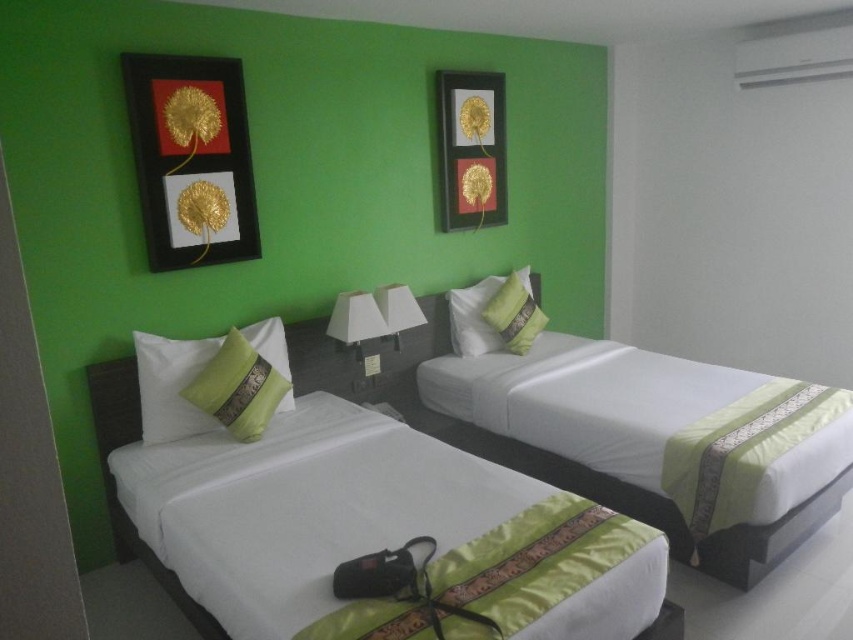
Question: Is black matte picture frame at upper left bigger than green satin pillow at center?

Choices:
 (A) no
 (B) yes

Answer: (B)

Question: Which object appears closest to the camera in this image?

Choices:
 (A) satin white bed at center
 (B) green satin pillow at left
 (C) green satin pillow at center

Answer: (A)

Question: Which point appears farthest from the camera in this image?

Choices:
 (A) pyautogui.click(x=498, y=294)
 (B) pyautogui.click(x=532, y=465)
 (C) pyautogui.click(x=497, y=80)
 (D) pyautogui.click(x=241, y=161)

Answer: (C)

Question: Which object is positioned closest to the gold leaf picture frame at upper center?

Choices:
 (A) satin white bed at center
 (B) green satin pillow at left
 (C) black matte picture frame at upper left

Answer: (C)

Question: Is satin white bed at center further to camera compared to gold leaf picture frame at upper center?

Choices:
 (A) yes
 (B) no

Answer: (B)

Question: Observing the image, what is the correct spatial positioning of satin white bed at center in reference to green satin pillow at center?

Choices:
 (A) left
 (B) right

Answer: (A)